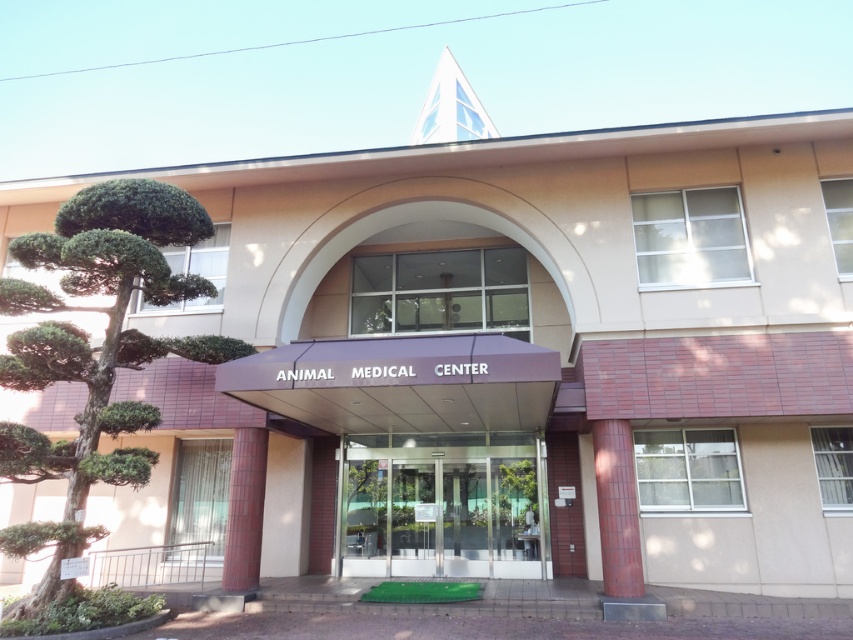
Does green leafy tree at left have a greater height compared to transparent glass door at center?

Yes.

In the scene shown: Measure the distance between green leafy tree at left and camera.

They are 21.35 feet apart.

Identify the location of green leafy tree at left. (96, 352).